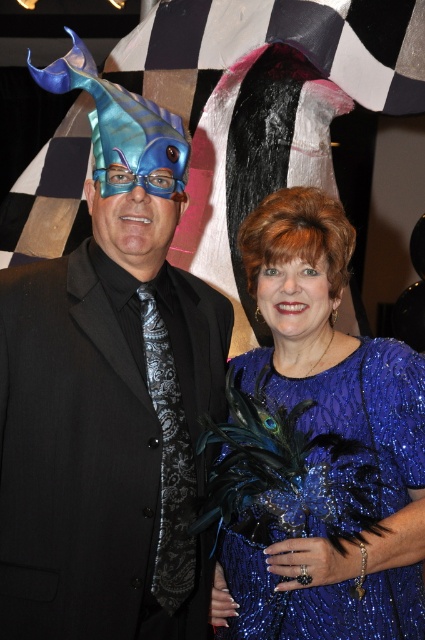
Who is lower down, sparkly blue dress at center or blue glossy goggles at center?

Positioned lower is sparkly blue dress at center.

Is point (416, 481) closer to viewer compared to point (121, 168)?

No, it is not.

The width and height of the screenshot is (425, 640). I want to click on sparkly blue dress at center, so click(334, 497).

Which of these two, matte black suit at center or sparkly blue dress at center, stands shorter?

sparkly blue dress at center is shorter.

Identify the location of matte black suit at center. (107, 432).

Does matte black suit at center appear under blue glossy goggles at center?

Yes, matte black suit at center is below blue glossy goggles at center.

In the scene shown: Who is lower down, matte black suit at center or blue glossy goggles at center?

matte black suit at center is lower down.

Find the location of a particular element. This screenshot has width=425, height=640. matte black suit at center is located at coordinates (107, 432).